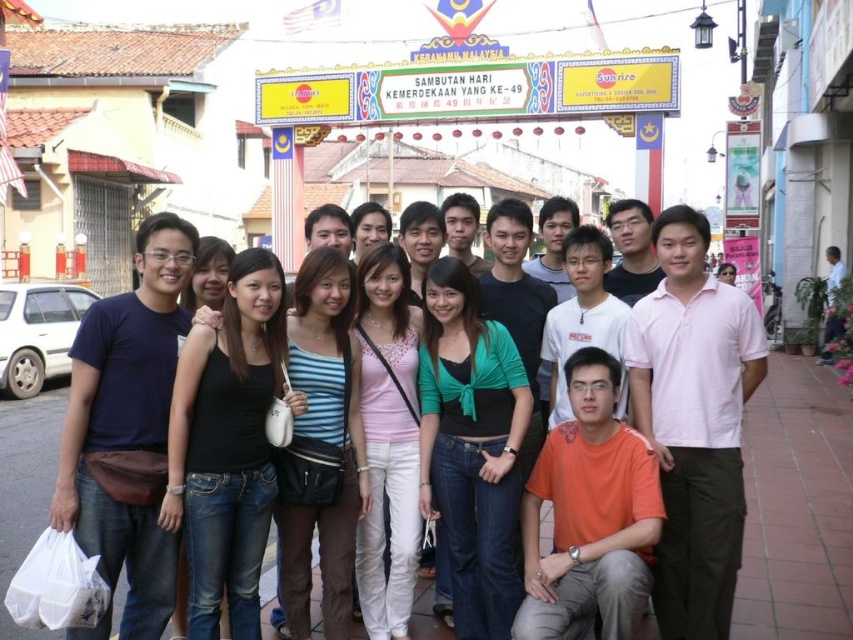
Question: Which object appears closest to the camera in this image?

Choices:
 (A) black fabric shirt at center
 (B) pink cotton shirt at center

Answer: (A)

Question: Can you confirm if dark blue t-shirt at center is positioned below black fabric shirt at center?

Choices:
 (A) no
 (B) yes

Answer: (B)

Question: Which of the following is the closest to the observer?

Choices:
 (A) pink cotton shirt at center
 (B) dark blue t-shirt at center

Answer: (B)

Question: Is pink cotton shirt at center wider than black fabric shirt at center?

Choices:
 (A) yes
 (B) no

Answer: (B)

Question: Does pink cotton shirt at center have a greater width compared to black fabric shirt at center?

Choices:
 (A) yes
 (B) no

Answer: (B)

Question: Among these objects, which one is nearest to the camera?

Choices:
 (A) dark blue t-shirt at center
 (B) pink cotton shirt at center
 (C) black fabric shirt at center

Answer: (A)